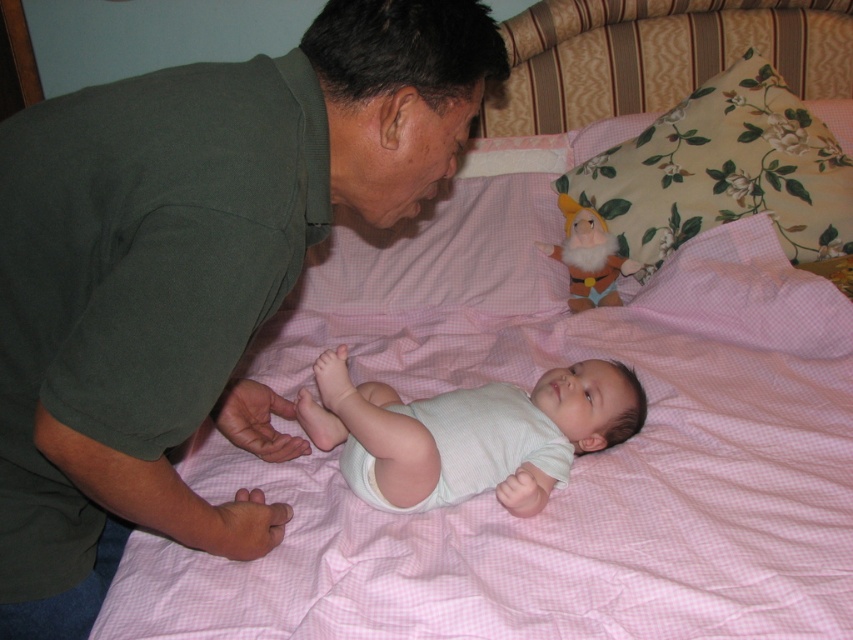
Can you confirm if green matte shirt at upper left is positioned above white cloth diaper at center?

Correct, green matte shirt at upper left is located above white cloth diaper at center.

Is point (97, 202) positioned in front of point (402, 508)?

Yes, point (97, 202) is closer to viewer.

Does point (270, 76) come farther from viewer compared to point (437, 404)?

No.

This screenshot has height=640, width=853. What are the coordinates of `green matte shirt at upper left` in the screenshot? It's located at (190, 275).

Which is in front, point (585, 168) or point (335, 426)?

Point (335, 426)

The image size is (853, 640). Describe the element at coordinates (722, 172) in the screenshot. I see `floral fabric pillow at upper right` at that location.

Who is more distant from viewer, (802, 108) or (456, 480)?

The point (802, 108) is more distant.

The image size is (853, 640). What are the coordinates of `floral fabric pillow at upper right` in the screenshot? It's located at (722, 172).

Which is above, white ribbed onesie at center or white cloth diaper at center?

white ribbed onesie at center is above.

Is white ribbed onesie at center shorter than white cloth diaper at center?

No.

Where is `white ribbed onesie at center`? white ribbed onesie at center is located at coordinates (469, 433).